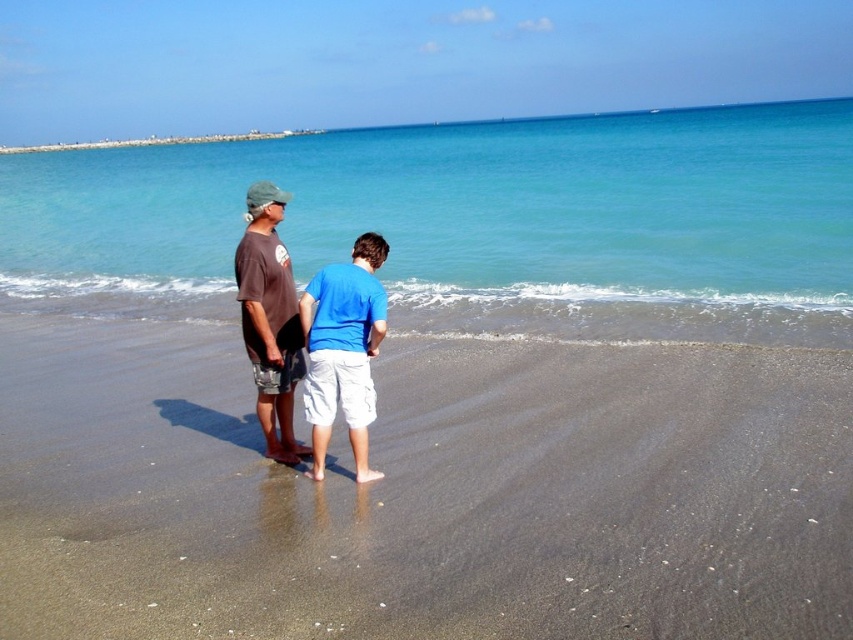
You are a drone operator trying to capture a photo of the beach scene. The drone is currently hovering at point coordinates of 0.5, 0.5. To get a clear shot of the dark brown sand at lower center, should you move the drone north or south?

The dark brown sand at lower center is located at point (450, 484). Since the drone is at (426, 320), moving north would increase the y coordinate. The dark brown sand has a y coordinate of 0.529, which is higher than 0.5, so moving north would bring the drone closer to the dark brown sand at lower center.